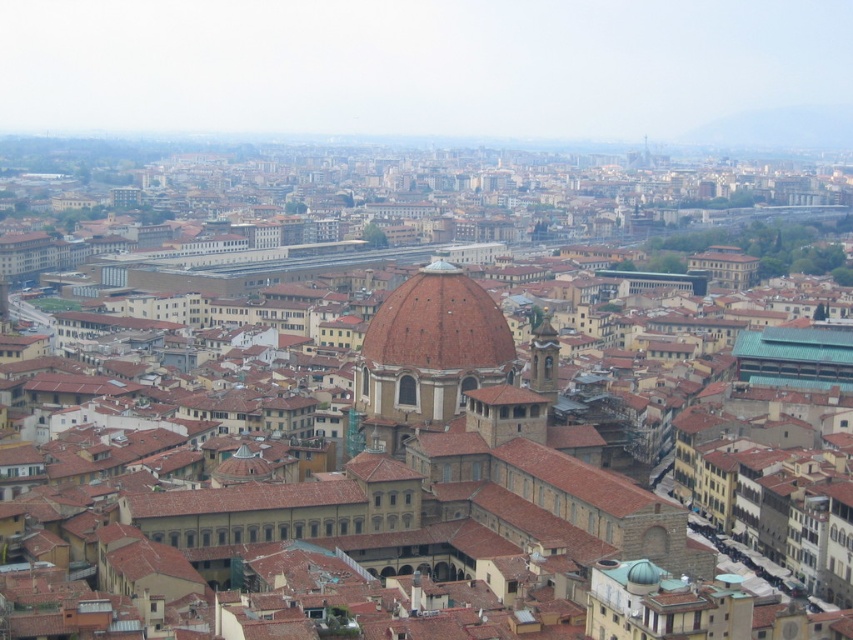
Is point (450, 280) positioned before point (535, 381)?

No, (450, 280) is further to viewer.

Is brown matte dome at center closer to the viewer compared to golden stone tower at center-right?

Yes, it is in front of golden stone tower at center-right.

Who is more forward, [454,307] or [546,397]?

Point [546,397] is more forward.

Where is `brown matte dome at center`? brown matte dome at center is located at coordinates (438, 324).